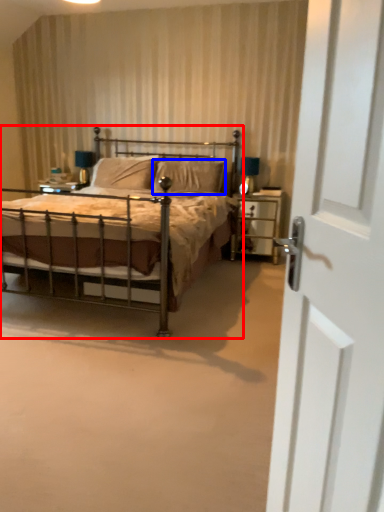
Question: Which object appears closest to the camera in this image, bed (highlighted by a red box) or pillow (highlighted by a blue box)?

Choices:
 (A) bed
 (B) pillow

Answer: (A)